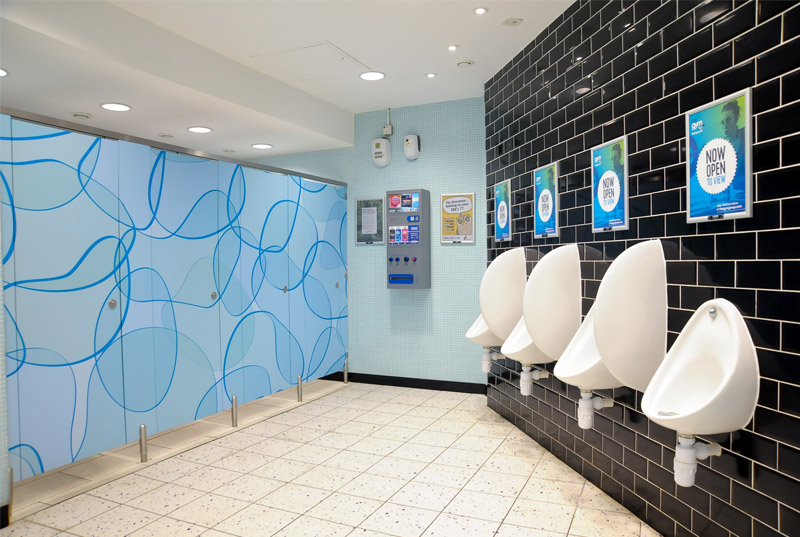
Find the location of a particular element. Image resolution: width=800 pixels, height=537 pixels. ceramic floor is located at coordinates (329, 481).